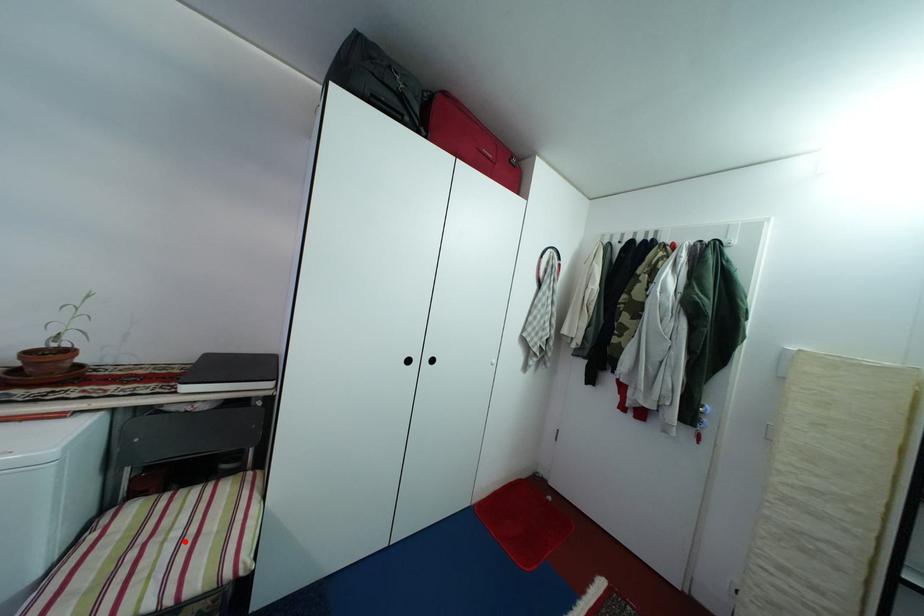
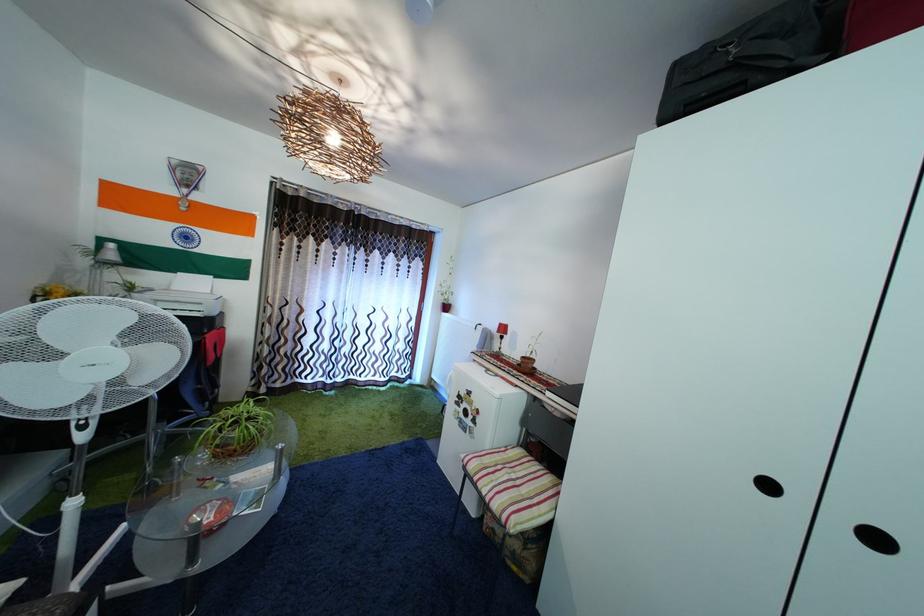
Find the pixel in the second image that matches the highlighted location in the first image.

(521, 484)